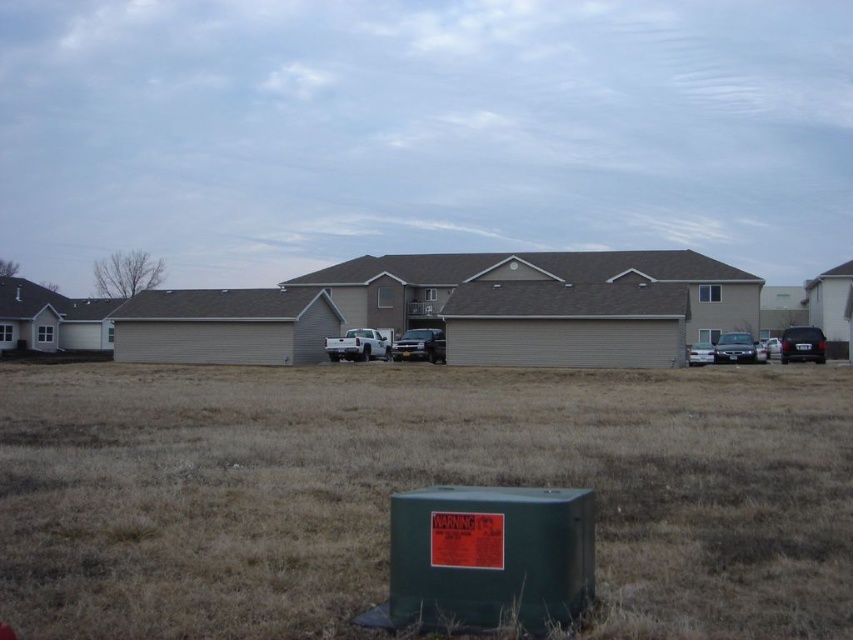
Does point (419, 346) come in front of point (706, 348)?

No, it is behind (706, 348).

Between point (418, 342) and point (700, 342), which one is positioned in front?

Point (418, 342)

Which is in front, point (438, 362) or point (695, 352)?

Point (695, 352)

Where is `metallic silver truck at center`? The image size is (853, 640). metallic silver truck at center is located at coordinates (419, 346).

Is brown dry grass at lower center above white glossy sedan at center?

Incorrect, brown dry grass at lower center is not positioned above white glossy sedan at center.

Between brown dry grass at lower center and white glossy sedan at center, which one is positioned higher?

white glossy sedan at center

Where is `brown dry grass at lower center`? The image size is (853, 640). brown dry grass at lower center is located at coordinates (415, 486).

Is point (341, 353) less distant than point (724, 348)?

No, (341, 353) is further to viewer.

This screenshot has width=853, height=640. What do you see at coordinates (357, 346) in the screenshot?
I see `white matte truck at center` at bounding box center [357, 346].

At what (x,y) coordinates should I click in order to perform the action: click on white matte truck at center. Please return your answer as a coordinate pair (x, y). The height and width of the screenshot is (640, 853). Looking at the image, I should click on (357, 346).